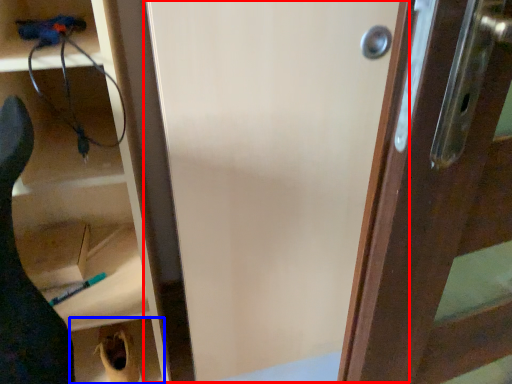
Question: Which point is closer to the camera, screen door (highlighted by a red box) or cabinetry (highlighted by a blue box)?

Choices:
 (A) screen door
 (B) cabinetry

Answer: (A)